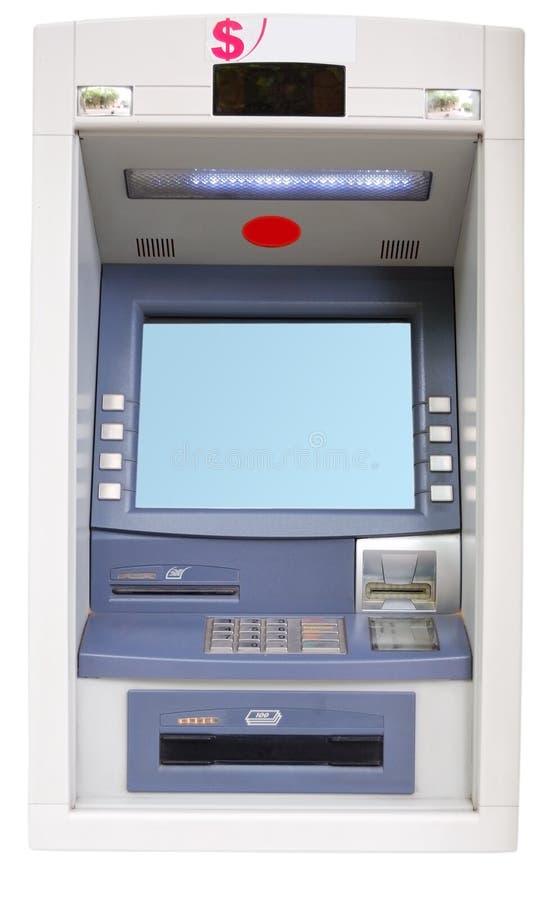
The image size is (549, 900). Find the location of `keypad`. keypad is located at coordinates pos(255,631).